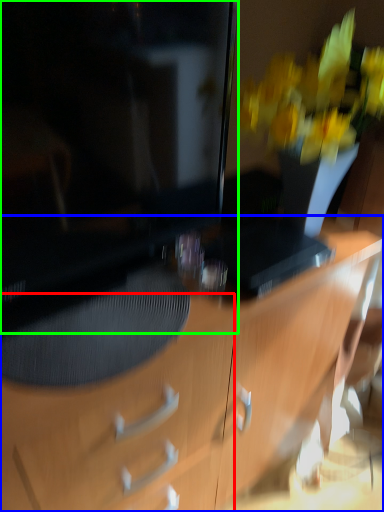
Question: Estimate the real-world distances between objects in this image. Which object is farther from drawer (highlighted by a red box), desk (highlighted by a blue box) or television (highlighted by a green box)?

Choices:
 (A) desk
 (B) television

Answer: (B)